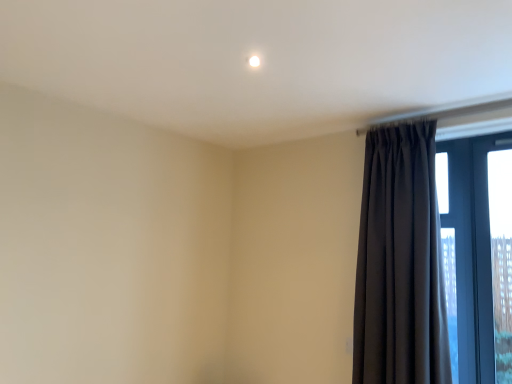
Question: Is clear glass window at right not within dark matte curtain at right?

Choices:
 (A) no
 (B) yes

Answer: (B)

Question: Is clear glass window at right facing towards dark matte curtain at right?

Choices:
 (A) yes
 (B) no

Answer: (B)

Question: Considering the relative positions of clear glass window at right and dark matte curtain at right in the image provided, is clear glass window at right to the left of dark matte curtain at right from the viewer's perspective?

Choices:
 (A) yes
 (B) no

Answer: (B)

Question: Can you confirm if clear glass window at right is wider than dark matte curtain at right?

Choices:
 (A) no
 (B) yes

Answer: (A)

Question: Is clear glass window at right placed right next to dark matte curtain at right?

Choices:
 (A) no
 (B) yes

Answer: (A)

Question: Does clear glass window at right have a lesser width compared to dark matte curtain at right?

Choices:
 (A) no
 (B) yes

Answer: (B)

Question: From a real-world perspective, is dark matte curtain at right positioned under clear glass window at right based on gravity?

Choices:
 (A) no
 (B) yes

Answer: (B)

Question: From a real-world perspective, is dark matte curtain at right positioned over clear glass window at right based on gravity?

Choices:
 (A) no
 (B) yes

Answer: (A)

Question: Can you confirm if dark matte curtain at right is smaller than clear glass window at right?

Choices:
 (A) yes
 (B) no

Answer: (B)

Question: Is dark matte curtain at right facing away from clear glass window at right?

Choices:
 (A) no
 (B) yes

Answer: (A)

Question: Can you confirm if dark matte curtain at right is shorter than clear glass window at right?

Choices:
 (A) yes
 (B) no

Answer: (B)

Question: Is dark matte curtain at right at the left side of clear glass window at right?

Choices:
 (A) no
 (B) yes

Answer: (B)

Question: From the image's perspective, is dark matte curtain at right positioned above or below clear glass window at right?

Choices:
 (A) below
 (B) above

Answer: (B)